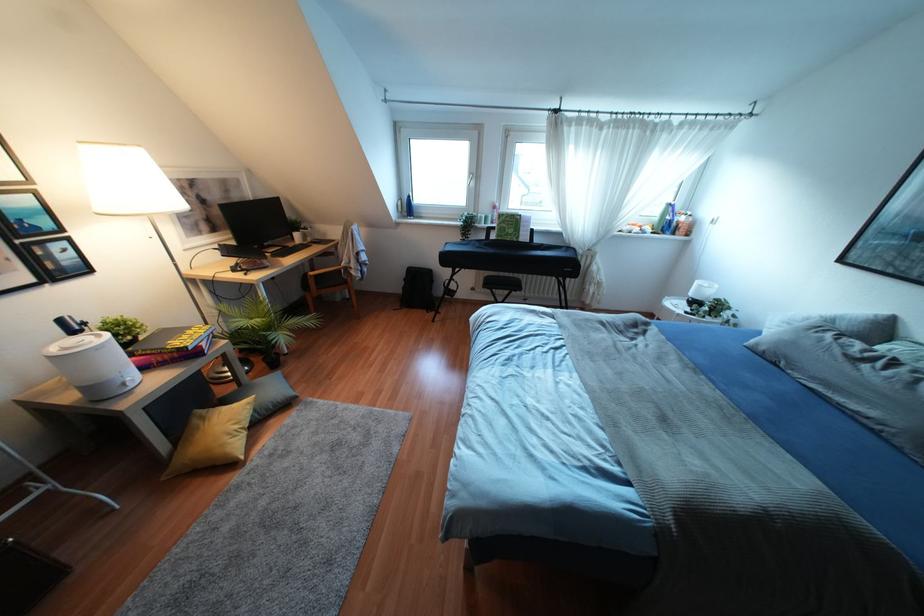
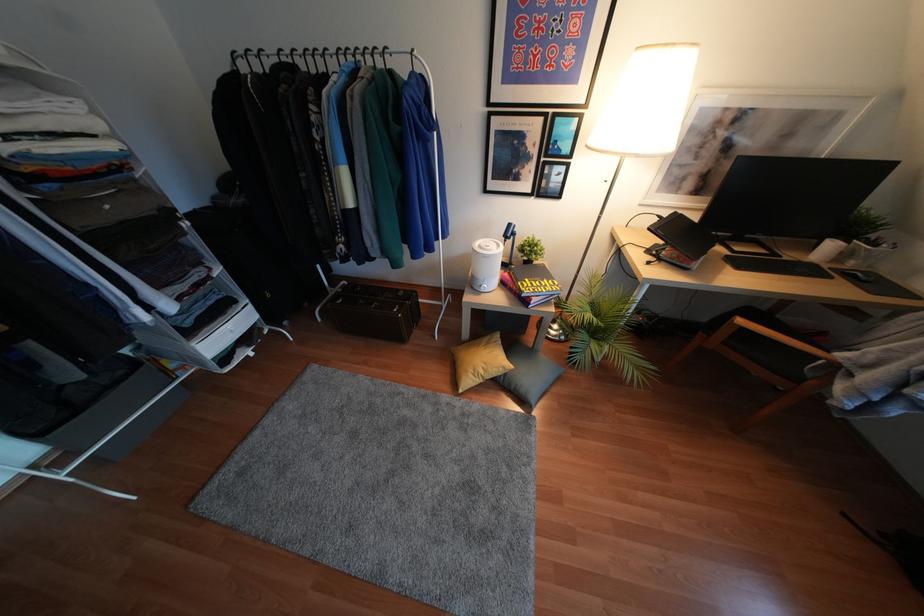
Where in the second image is the point corresponding to (114,315) from the first image?

(536, 237)